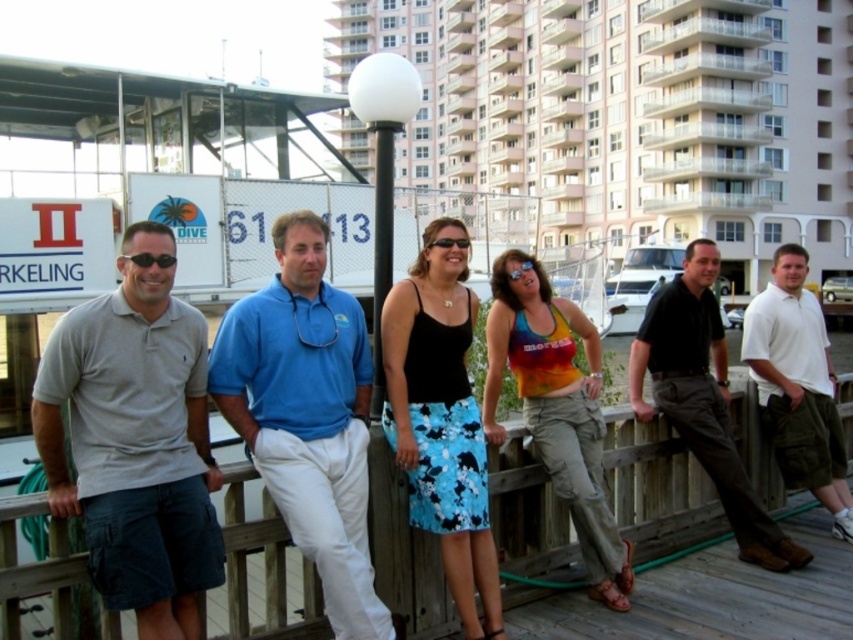
Who is taller, black satin tank top at center or dark brown leather pants at right?

dark brown leather pants at right is taller.

Can you confirm if black satin tank top at center is positioned to the right of dark brown leather pants at right?

In fact, black satin tank top at center is to the left of dark brown leather pants at right.

Where is `black satin tank top at center`? black satin tank top at center is located at coordinates (440, 419).

Identify the location of black satin tank top at center. [x=440, y=419].

How much distance is there between light gray cotton polo shirt at left and rainbow fabric tank top at center?

The distance of light gray cotton polo shirt at left from rainbow fabric tank top at center is 9.17 feet.

Image resolution: width=853 pixels, height=640 pixels. I want to click on light gray cotton polo shirt at left, so click(135, 440).

Where is `light gray cotton polo shirt at left`? light gray cotton polo shirt at left is located at coordinates (135, 440).

Who is positioned more to the right, light gray cotton polo shirt at left or blue cotton polo shirt at center?

blue cotton polo shirt at center is more to the right.

Who is positioned more to the left, light gray cotton polo shirt at left or blue cotton polo shirt at center?

Positioned to the left is light gray cotton polo shirt at left.

Between point (202, 435) and point (335, 572), which one is positioned behind?

Point (202, 435)

Locate an element on the screen. Image resolution: width=853 pixels, height=640 pixels. light gray cotton polo shirt at left is located at coordinates (135, 440).